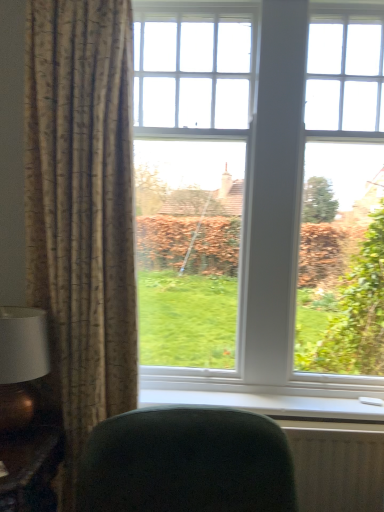
The height and width of the screenshot is (512, 384). I want to click on clear glass window at center, so click(x=256, y=190).

The image size is (384, 512). Describe the element at coordinates (186, 463) in the screenshot. I see `dark green fabric chair at lower center` at that location.

Locate an element on the screen. The width and height of the screenshot is (384, 512). clear glass window at center is located at coordinates (256, 190).

From the image's perspective, between textured beige curtain at left and white textured radiator at lower right, which one is located above?

textured beige curtain at left.

Can you confirm if textured beige curtain at left is thinner than white textured radiator at lower right?

Incorrect, the width of textured beige curtain at left is not less than that of white textured radiator at lower right.

Can you tell me how much textured beige curtain at left and white textured radiator at lower right differ in facing direction?

4.51 degrees separate the facing orientations of textured beige curtain at left and white textured radiator at lower right.

Could you tell me if textured beige curtain at left is facing white textured radiator at lower right?

No.

At what (x,y) coordinates should I click in order to perform the action: click on curtain that is above the white textured radiator at lower right (from a real-world perspective). Please return your answer as a coordinate pair (x, y). The height and width of the screenshot is (512, 384). Looking at the image, I should click on (82, 209).

How many degrees apart are the facing directions of white textured radiator at lower right and textured beige curtain at left?

The angle between the facing direction of white textured radiator at lower right and the facing direction of textured beige curtain at left is 4.51 degrees.

Looking at this image, would you say white textured radiator at lower right is a long distance from textured beige curtain at left?

white textured radiator at lower right is positioned a significant distance from textured beige curtain at left.

Could textured beige curtain at left be considered to be inside white textured radiator at lower right?

That's incorrect, textured beige curtain at left is not inside white textured radiator at lower right.

Are white plastic window sill at lower center and matte gold table lamp at left far apart?

No, white plastic window sill at lower center is not far from matte gold table lamp at left.

From a real-world perspective, is white plastic window sill at lower center on top of matte gold table lamp at left?

No.

Is white plastic window sill at lower center wider than matte gold table lamp at left?

No.

How distant is white plastic window sill at lower center from matte gold table lamp at left?

white plastic window sill at lower center and matte gold table lamp at left are 73.57 centimeters apart.

Visually, is white textured radiator at lower right positioned to the left or to the right of clear glass window at center?

From the image, it's evident that white textured radiator at lower right is to the right of clear glass window at center.

Considering the sizes of objects white textured radiator at lower right and clear glass window at center in the image provided, who is wider, white textured radiator at lower right or clear glass window at center?

clear glass window at center.

Does white textured radiator at lower right have a larger size compared to clear glass window at center?

No, white textured radiator at lower right is not bigger than clear glass window at center.

Can you tell me how much dark green fabric chair at lower center and white plastic window sill at lower center differ in facing direction?

dark green fabric chair at lower center and white plastic window sill at lower center are facing 9.31 degrees away from each other.

Does dark green fabric chair at lower center have a lesser width compared to white plastic window sill at lower center?

No.

Which point is more distant from viewer, (x=233, y=435) or (x=251, y=408)?

Positioned behind is point (x=251, y=408).

How much distance is there between dark green fabric chair at lower center and white plastic window sill at lower center?

dark green fabric chair at lower center is 12.15 inches from white plastic window sill at lower center.

How distant is wooden table at lower left from clear glass window at center?

A distance of 3.78 feet exists between wooden table at lower left and clear glass window at center.

Which is correct: wooden table at lower left is inside clear glass window at center, or outside of it?

wooden table at lower left is spatially situated outside clear glass window at center.

Is wooden table at lower left looking in the opposite direction of clear glass window at center?

No, wooden table at lower left's orientation is not away from clear glass window at center.

From the image's perspective, is wooden table at lower left below clear glass window at center?

Correct, wooden table at lower left appears lower than clear glass window at center in the image.

How distant is wooden table at lower left from matte gold table lamp at left?

wooden table at lower left is 8.25 inches away from matte gold table lamp at left.

Which object is closer to the camera taking this photo, wooden table at lower left or matte gold table lamp at left?

wooden table at lower left is in front.

Is wooden table at lower left turned away from matte gold table lamp at left?

No, wooden table at lower left's orientation is not away from matte gold table lamp at left.

Locate an element on the screen. table below the matte gold table lamp at left (from the image's perspective) is located at coordinates (30, 469).

Identify the location of curtain that is in front of the white textured radiator at lower right. (82, 209).

Image resolution: width=384 pixels, height=512 pixels. Identify the location of radiator on the right of textured beige curtain at left. (337, 466).

Which object lies nearer to the anchor point wooden table at lower left, textured beige curtain at left or white plastic window sill at lower center?

textured beige curtain at left.

Which object lies nearer to the anchor point wooden table at lower left, dark green fabric chair at lower center or white textured radiator at lower right?

Among the two, dark green fabric chair at lower center is located nearer to wooden table at lower left.

Considering their positions, is clear glass window at center positioned further to matte gold table lamp at left than dark green fabric chair at lower center?

clear glass window at center is further to matte gold table lamp at left.

Looking at the image, which one is located further to textured beige curtain at left, clear glass window at center or matte gold table lamp at left?

clear glass window at center.

From the image, which object appears to be farther from wooden table at lower left, dark green fabric chair at lower center or white plastic window sill at lower center?

Based on the image, white plastic window sill at lower center appears to be further to wooden table at lower left.

Considering their positions, is wooden table at lower left positioned closer to clear glass window at center than white plastic window sill at lower center?

white plastic window sill at lower center lies closer to clear glass window at center than the other object.

Based on their spatial positions, is white plastic window sill at lower center or textured beige curtain at left further from white textured radiator at lower right?

Among the two, textured beige curtain at left is located further to white textured radiator at lower right.

Considering their positions, is wooden table at lower left positioned closer to white plastic window sill at lower center than textured beige curtain at left?

wooden table at lower left.

The height and width of the screenshot is (512, 384). In order to click on table lamp between textured beige curtain at left and dark green fabric chair at lower center in the up-down direction in this screenshot , I will do `click(21, 364)`.

You are a GUI agent. You are given a task and a screenshot of the screen. Output one action in this format:
    pyautogui.click(x=<x>, y=<y>)
    Task: Click on the curtain between matte gold table lamp at left and white textured radiator at lower right from left to right
    The image size is (384, 512).
    Given the screenshot: What is the action you would take?
    pyautogui.click(x=82, y=209)

In order to click on table lamp between clear glass window at center and wooden table at lower left from top to bottom in this screenshot , I will do `click(21, 364)`.

Locate an element on the screen. The height and width of the screenshot is (512, 384). table lamp located between wooden table at lower left and white textured radiator at lower right in the left-right direction is located at coordinates (21, 364).